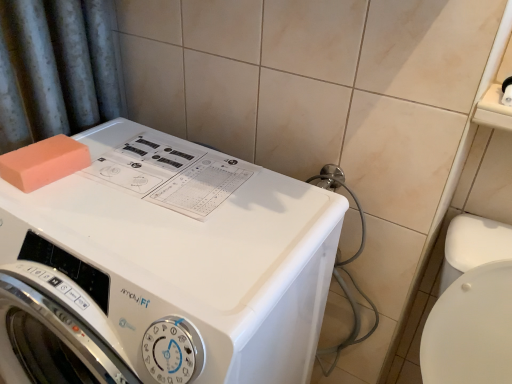
Find the location of `free space in front of orange matte sponge at top left`. free space in front of orange matte sponge at top left is located at coordinates (49, 206).